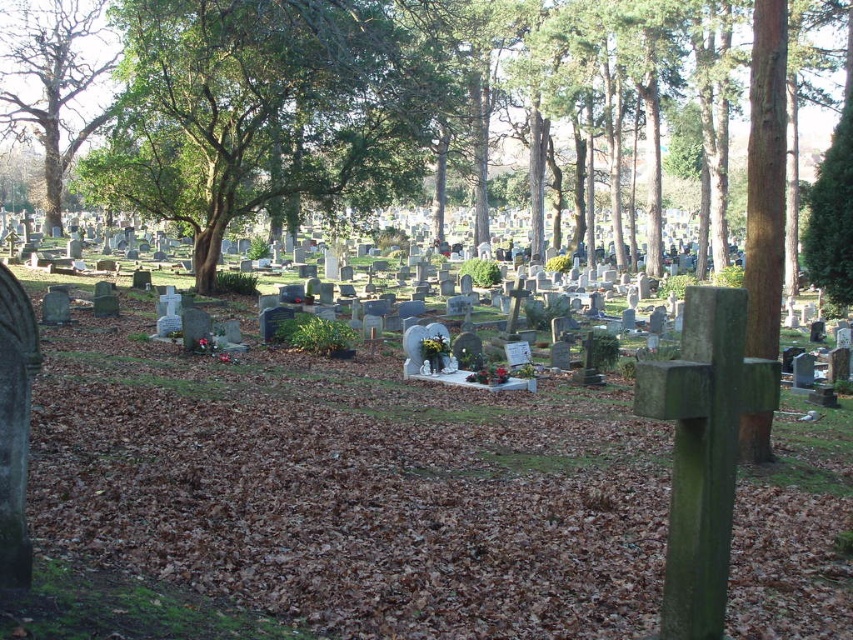
Question: Does smooth stone cross at center lie behind green leafy tree at center?

Choices:
 (A) no
 (B) yes

Answer: (A)

Question: Is smooth stone cross at center wider than green leafy tree at center?

Choices:
 (A) no
 (B) yes

Answer: (B)

Question: Can you confirm if smooth stone cross at center is positioned below green leafy tree at upper left?

Choices:
 (A) yes
 (B) no

Answer: (A)

Question: Among these objects, which one is nearest to the camera?

Choices:
 (A) green leafy tree at upper left
 (B) green leafy tree at center

Answer: (B)

Question: Based on their relative distances, which object is nearer to the smooth stone cross at center?

Choices:
 (A) green leafy tree at upper left
 (B) green leafy tree at center

Answer: (B)

Question: Estimate the real-world distances between objects in this image. Which object is farther from the green leafy tree at center?

Choices:
 (A) smooth stone cross at center
 (B) green leafy tree at upper left

Answer: (B)